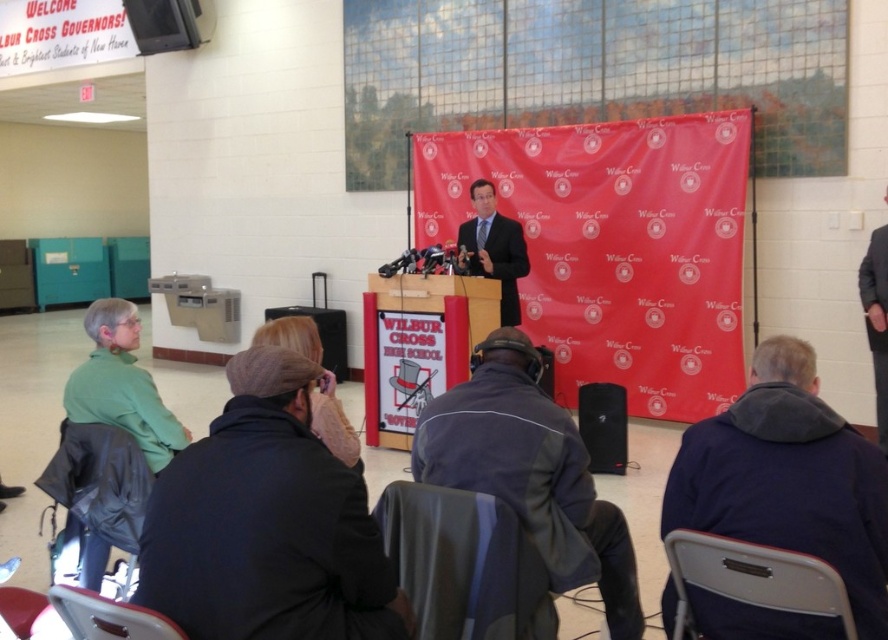
Is dark gray fabric jacket at lower center bigger than gray suit at right?

Yes, dark gray fabric jacket at lower center is bigger than gray suit at right.

Can you confirm if dark gray fabric jacket at lower center is thinner than gray suit at right?

No, dark gray fabric jacket at lower center is not thinner than gray suit at right.

Does point (501, 326) come in front of point (882, 323)?

Yes, point (501, 326) is closer to viewer.

Locate an element on the screen. This screenshot has height=640, width=888. dark gray fabric jacket at lower center is located at coordinates (530, 472).

This screenshot has height=640, width=888. In order to click on dark gray fabric jacket at lower center in this screenshot , I will do `click(530, 472)`.

Can you confirm if dark gray fabric jacket at lower center is positioned to the right of dark gray fabric chair at lower center?

Yes, dark gray fabric jacket at lower center is to the right of dark gray fabric chair at lower center.

Which is in front, point (496, 449) or point (546, 593)?

Point (546, 593) is more forward.

Identify the location of dark gray fabric jacket at lower center. (530, 472).

Who is taller, dark blue jacket at lower right or metallic gray chair at lower left?

dark blue jacket at lower right is taller.

Is point (768, 465) positioned in front of point (94, 637)?

That is False.

Between point (868, 484) and point (121, 609), which one is positioned in front?

Positioned in front is point (121, 609).

Find the location of a particular element. The image size is (888, 640). dark blue jacket at lower right is located at coordinates (789, 477).